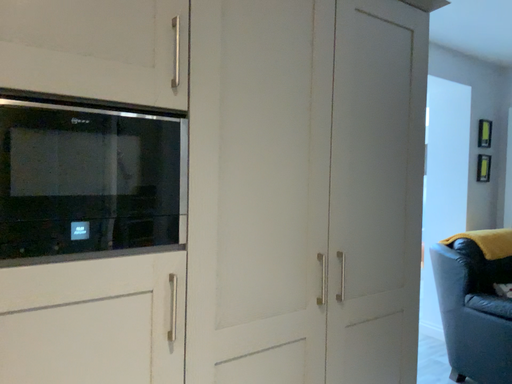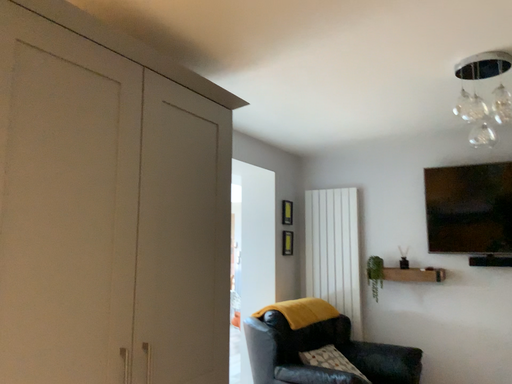
Question: Which way did the camera rotate in the video?

Choices:
 (A) rotated downward
 (B) rotated upward

Answer: (B)